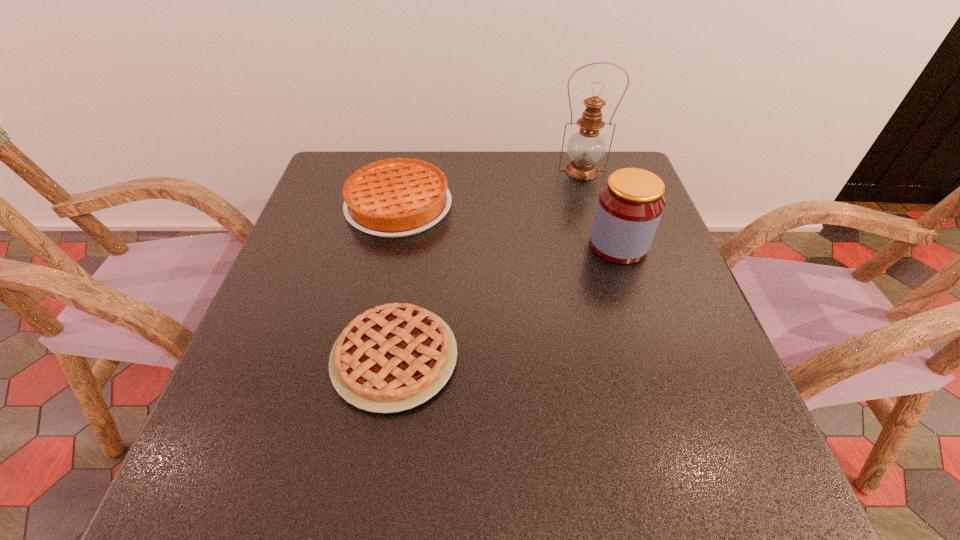
In order to click on oil lamp at the far edge in this screenshot , I will do `click(586, 147)`.

Find the location of a particular element. pie located at the far edge is located at coordinates (391, 198).

Find the location of `object located at the left edge`. object located at the left edge is located at coordinates (391, 198).

At what (x,y) coordinates should I click in order to perform the action: click on oil lamp that is positioned at the right edge. Please return your answer as a coordinate pair (x, y). This screenshot has width=960, height=540. Looking at the image, I should click on (586, 147).

Find the location of a particular element. This screenshot has height=540, width=960. jar present at the right edge is located at coordinates point(629,208).

Locate an element on the screen. object at the far left corner is located at coordinates (391, 198).

Find the location of a particular element. object present at the far right corner is located at coordinates (586, 147).

You are a GUI agent. You are given a task and a screenshot of the screen. Output one action in this format:
    pyautogui.click(x=<x>, y=<y>)
    Task: Click on the vacant point at the far edge
    Image resolution: width=960 pixels, height=540 pixels.
    Given the screenshot: What is the action you would take?
    pyautogui.click(x=407, y=150)

Image resolution: width=960 pixels, height=540 pixels. Find the location of `vacant region at the left edge of the desktop`. vacant region at the left edge of the desktop is located at coordinates click(316, 362).

Locate an element on the screen. The image size is (960, 540). free space at the right edge of the desktop is located at coordinates (636, 268).